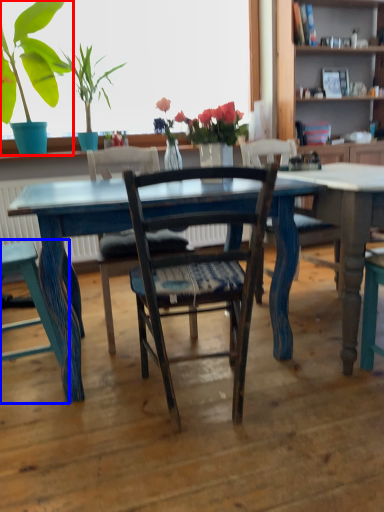
Question: Which object appears farthest to the camera in this image, houseplant (highlighted by a red box) or chair (highlighted by a blue box)?

Choices:
 (A) houseplant
 (B) chair

Answer: (A)